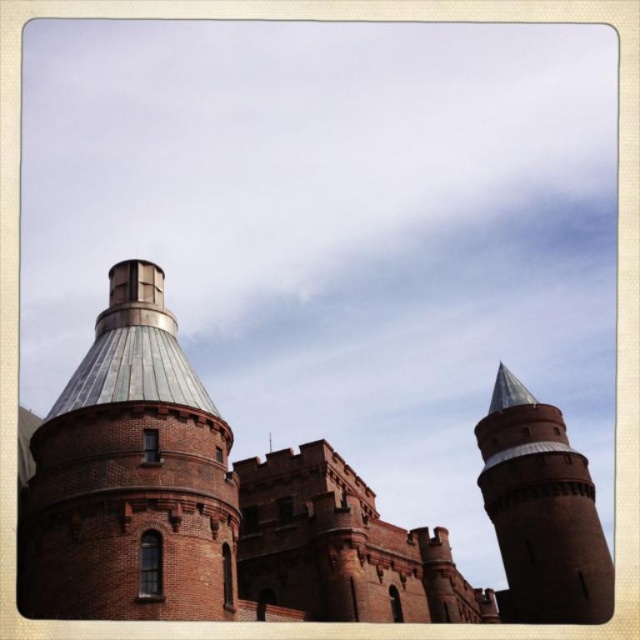
Locate an element on the screen. red brick castle at center is located at coordinates [273, 504].

Is red brick castle at center to the right of brick tower at upper right from the viewer's perspective?

Incorrect, red brick castle at center is not on the right side of brick tower at upper right.

The image size is (640, 640). What are the coordinates of `red brick castle at center` in the screenshot? It's located at (273, 504).

Locate an element on the screen. The image size is (640, 640). red brick castle at center is located at coordinates (273, 504).

Does red brick castle at center appear under shiny metallic dome at center?

Yes.

Does red brick castle at center have a greater height compared to shiny metallic dome at center?

Yes.

Which is behind, point (211, 483) or point (163, 416)?

The point (163, 416) is behind.

Locate an element on the screen. The width and height of the screenshot is (640, 640). red brick castle at center is located at coordinates (273, 504).

Which is behind, point (172, 609) or point (497, 396)?

The point (497, 396) is more distant.

Is shiny metallic dome at center positioned at the back of brick tower at upper right?

No, it is not.

Who is more forward, (225, 422) or (596, 614)?

Point (225, 422)

Identify the location of shiny metallic dome at center. The width and height of the screenshot is (640, 640). (131, 477).